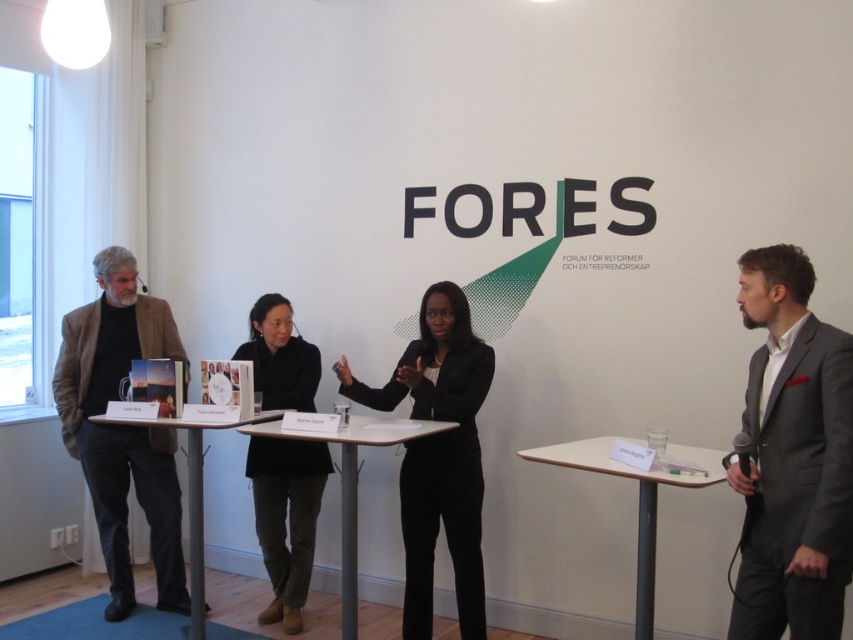
Between light wood table at lower right and wooden table at center, which one has less height?

light wood table at lower right

The width and height of the screenshot is (853, 640). In order to click on light wood table at lower right in this screenshot , I will do `click(637, 496)`.

Where is `light wood table at lower right`? light wood table at lower right is located at coordinates (637, 496).

Is dark brown leather jacket at center closer to the viewer compared to matte black table at center?

No.

Measure the distance between dark brown leather jacket at center and camera.

dark brown leather jacket at center and camera are 11.03 feet apart from each other.

Find the location of a particular element. dark brown leather jacket at center is located at coordinates (285, 518).

Find the location of a particular element. dark brown leather jacket at center is located at coordinates (285, 518).

Between brown woolen jacket at left and black matte suit at center, which one is positioned lower?

Positioned lower is black matte suit at center.

Which of these two, brown woolen jacket at left or black matte suit at center, stands shorter?

black matte suit at center is shorter.

This screenshot has height=640, width=853. What are the coordinates of `brown woolen jacket at left` in the screenshot? It's located at (122, 428).